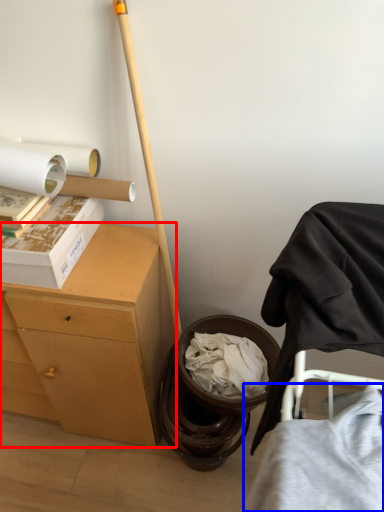
Question: Which point is further to the camera, desk (highlighted by a red box) or clothing (highlighted by a blue box)?

Choices:
 (A) desk
 (B) clothing

Answer: (A)